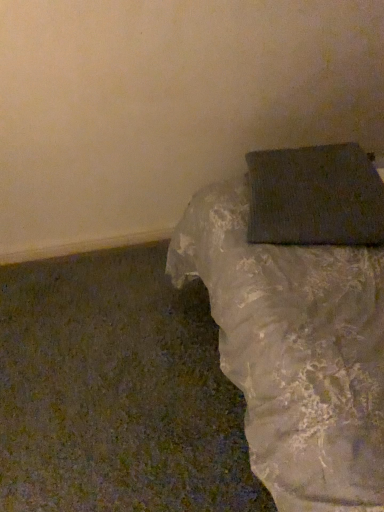
Question: Should I look upward or downward to see matte gray box at upper right?

Choices:
 (A) up
 (B) down

Answer: (A)

Question: Considering the relative sizes of matte gray wrapping paper at lower right and matte gray box at upper right in the image provided, is matte gray wrapping paper at lower right smaller than matte gray box at upper right?

Choices:
 (A) no
 (B) yes

Answer: (B)

Question: Does matte gray wrapping paper at lower right lie in front of matte gray box at upper right?

Choices:
 (A) yes
 (B) no

Answer: (B)

Question: From a real-world perspective, is matte gray wrapping paper at lower right on top of matte gray box at upper right?

Choices:
 (A) no
 (B) yes

Answer: (B)

Question: From the image's perspective, is matte gray wrapping paper at lower right on top of matte gray box at upper right?

Choices:
 (A) yes
 (B) no

Answer: (A)

Question: Considering the relative sizes of matte gray wrapping paper at lower right and matte gray box at upper right in the image provided, is matte gray wrapping paper at lower right bigger than matte gray box at upper right?

Choices:
 (A) no
 (B) yes

Answer: (A)

Question: Are matte gray wrapping paper at lower right and matte gray box at upper right far apart?

Choices:
 (A) no
 (B) yes

Answer: (A)

Question: Does matte gray box at upper right have a smaller size compared to matte gray wrapping paper at lower right?

Choices:
 (A) no
 (B) yes

Answer: (A)

Question: Considering the relative sizes of matte gray box at upper right and matte gray wrapping paper at lower right in the image provided, is matte gray box at upper right taller than matte gray wrapping paper at lower right?

Choices:
 (A) no
 (B) yes

Answer: (B)

Question: From a real-world perspective, is matte gray box at upper right on top of matte gray wrapping paper at lower right?

Choices:
 (A) yes
 (B) no

Answer: (B)

Question: Can you confirm if matte gray box at upper right is wider than matte gray wrapping paper at lower right?

Choices:
 (A) yes
 (B) no

Answer: (A)

Question: Is matte gray box at upper right directly adjacent to matte gray wrapping paper at lower right?

Choices:
 (A) yes
 (B) no

Answer: (B)

Question: Is matte gray box at upper right to the right of matte gray wrapping paper at lower right from the viewer's perspective?

Choices:
 (A) no
 (B) yes

Answer: (B)

Question: Is matte gray box at upper right situated inside matte gray wrapping paper at lower right or outside?

Choices:
 (A) inside
 (B) outside

Answer: (B)